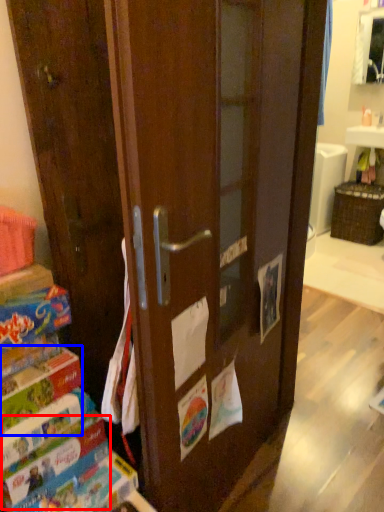
Question: Among these objects, which one is nearest to the camera, paperback book (highlighted by a red box) or paperback book (highlighted by a blue box)?

Choices:
 (A) paperback book
 (B) paperback book

Answer: (B)